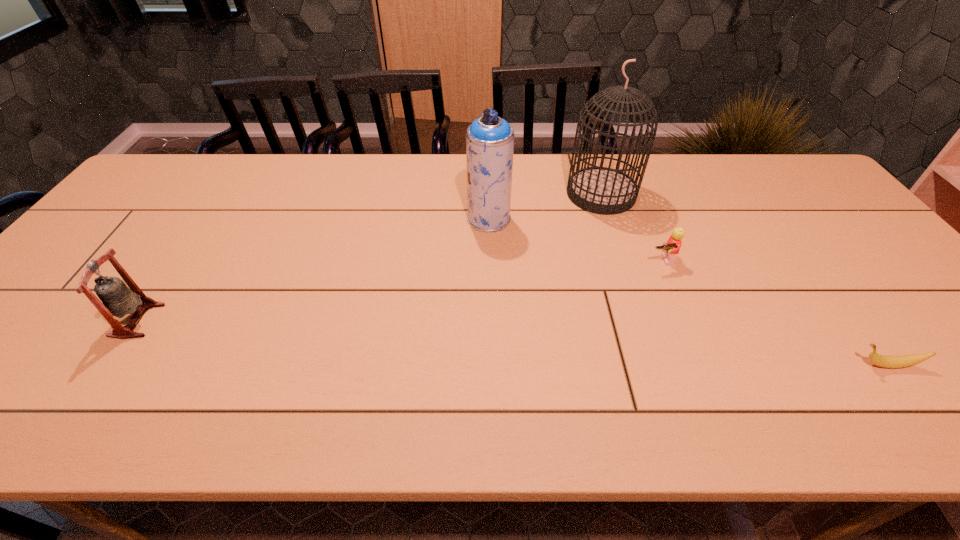
The width and height of the screenshot is (960, 540). Find the location of `free area in between the tallest object and the third shortest object`. free area in between the tallest object and the third shortest object is located at coordinates (370, 257).

You are a GUI agent. You are given a task and a screenshot of the screen. Output one action in this format:
    pyautogui.click(x=<x>, y=<y>)
    Task: Click on the empty location between the tallest object and the nearest object
    
    Given the screenshot: What is the action you would take?
    pyautogui.click(x=744, y=280)

I want to click on vacant area between the aerosol can and the rightmost object, so click(687, 292).

The image size is (960, 540). I want to click on object that is the closest one to the Lego, so click(600, 190).

Locate which object ranks third in proximity to the rightmost object. Please provide its 2D coordinates. Your answer should be formatted as a tuple, i.e. [(x, y)], where the tuple contains the x and y coordinates of a point satisfying the conditions above.

[(489, 139)]

You are a GUI agent. You are given a task and a screenshot of the screen. Output one action in this format:
    pyautogui.click(x=<x>, y=<y>)
    Task: Click on the free spot that satisfies the following two spatial constraints: 1. on the back side of the fourth farthest object; 2. on the left side of the second tallest object
    This screenshot has width=960, height=540.
    Given the screenshot: What is the action you would take?
    pyautogui.click(x=207, y=219)